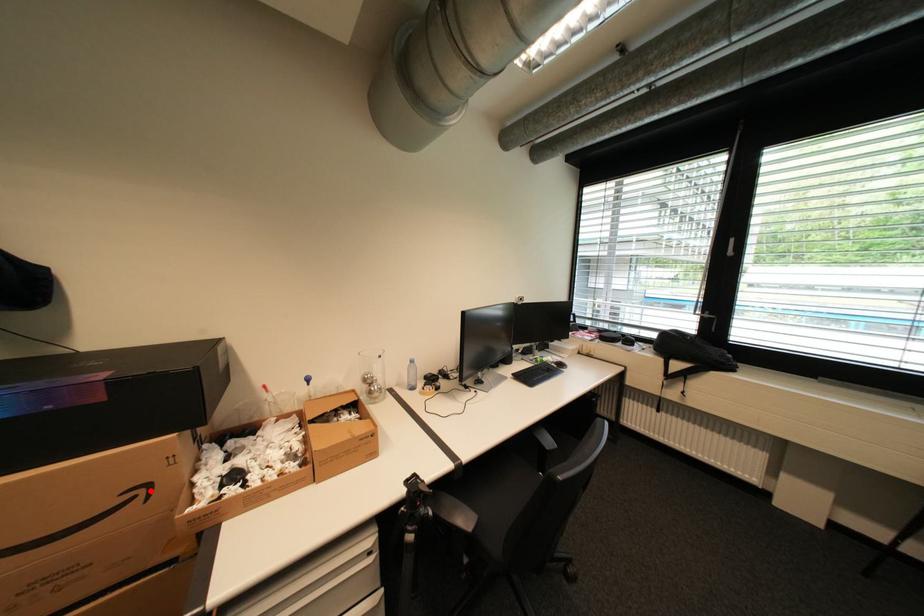
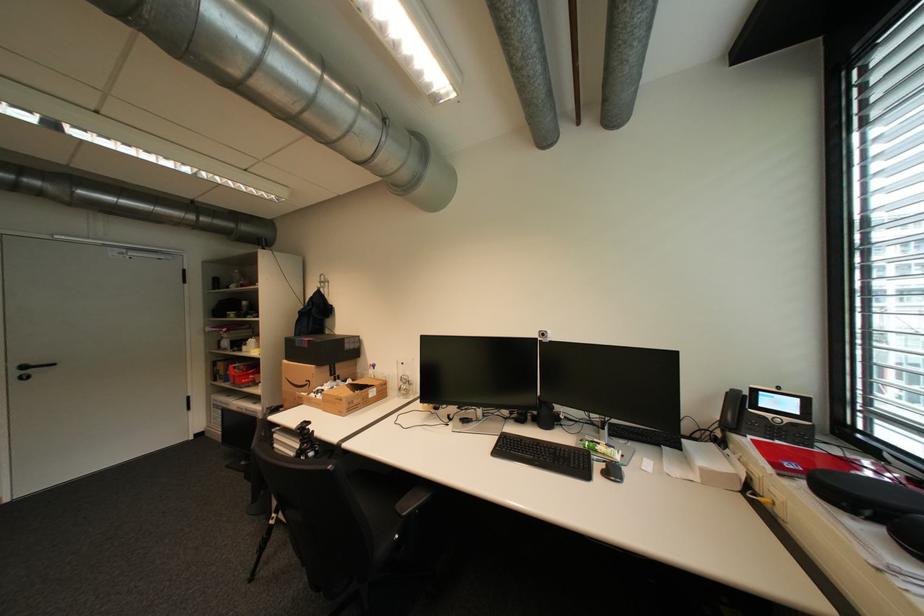
Question: I am providing you with two images of the same scene from different viewpoints. A red point is shown in image1. For the corresponding object point in image2, is it positioned nearer or farther from the camera?

Choices:
 (A) Nearer
 (B) Farther

Answer: (B)